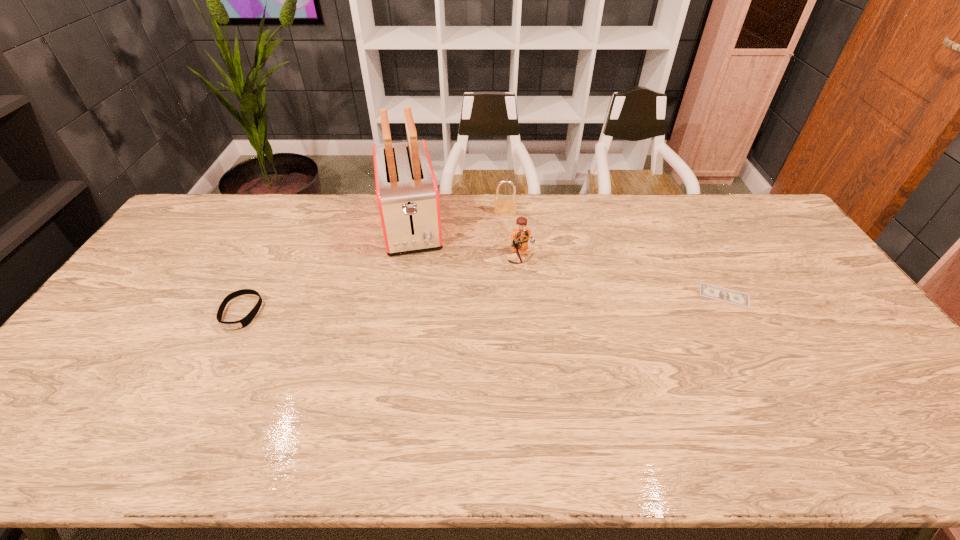
Find the location of a particular element. vacant area that lies between the padlock and the second object from left to right is located at coordinates (458, 219).

Identify the location of unoccupied position between the leftmost object and the Lego. (381, 285).

Locate an element on the screen. This screenshot has height=540, width=960. unoccupied position between the money and the padlock is located at coordinates (614, 254).

Find the location of a particular element. Image resolution: width=960 pixels, height=540 pixels. empty location between the second object from left to right and the Lego is located at coordinates (466, 241).

Locate an element on the screen. The width and height of the screenshot is (960, 540). vacant space that's between the money and the Lego is located at coordinates (622, 276).

At what (x,y) coordinates should I click in order to perform the action: click on object that stands as the closest to the padlock. Please return your answer as a coordinate pair (x, y). This screenshot has width=960, height=540. Looking at the image, I should click on (521, 234).

The image size is (960, 540). Find the location of `object that stands as the fourth closest to the wristband`. object that stands as the fourth closest to the wristband is located at coordinates (709, 291).

I want to click on vacant position in the image that satisfies the following two spatial constraints: 1. on the back side of the tallest object; 2. on the left side of the padlock, so click(413, 213).

You are a GUI agent. You are given a task and a screenshot of the screen. Output one action in this format:
    pyautogui.click(x=<x>, y=<y>)
    Task: Click on the free space that satisfies the following two spatial constraints: 1. on the back side of the padlock; 2. on the left side of the toaster
    
    Given the screenshot: What is the action you would take?
    pyautogui.click(x=413, y=213)

I want to click on free space that satisfies the following two spatial constraints: 1. on the back side of the toaster; 2. on the right side of the padlock, so click(413, 213).